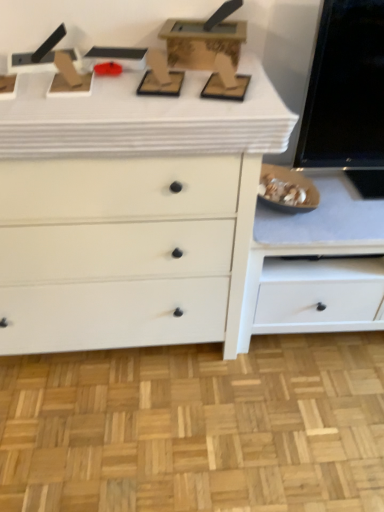
Question: Considering the positions of white matte cabinet at lower right and white matte chest of drawers at center in the image, is white matte cabinet at lower right bigger or smaller than white matte chest of drawers at center?

Choices:
 (A) big
 (B) small

Answer: (B)

Question: From a real-world perspective, relative to white matte chest of drawers at center, is white matte cabinet at lower right vertically above or below?

Choices:
 (A) below
 (B) above

Answer: (A)

Question: Estimate the real-world distances between objects in this image. Which object is farther from the white matte counter top at upper center?

Choices:
 (A) white matte chest of drawers at center
 (B) white matte cabinet at lower right

Answer: (B)

Question: Considering the real-world distances, which object is closest to the white matte counter top at upper center?

Choices:
 (A) white matte cabinet at lower right
 (B) white matte chest of drawers at center

Answer: (B)